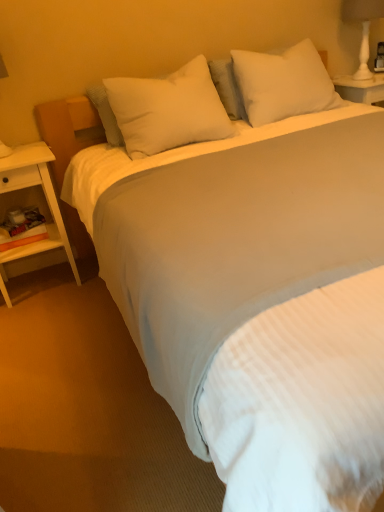
I want to click on free point in front of white wood nightstand at left, so click(43, 321).